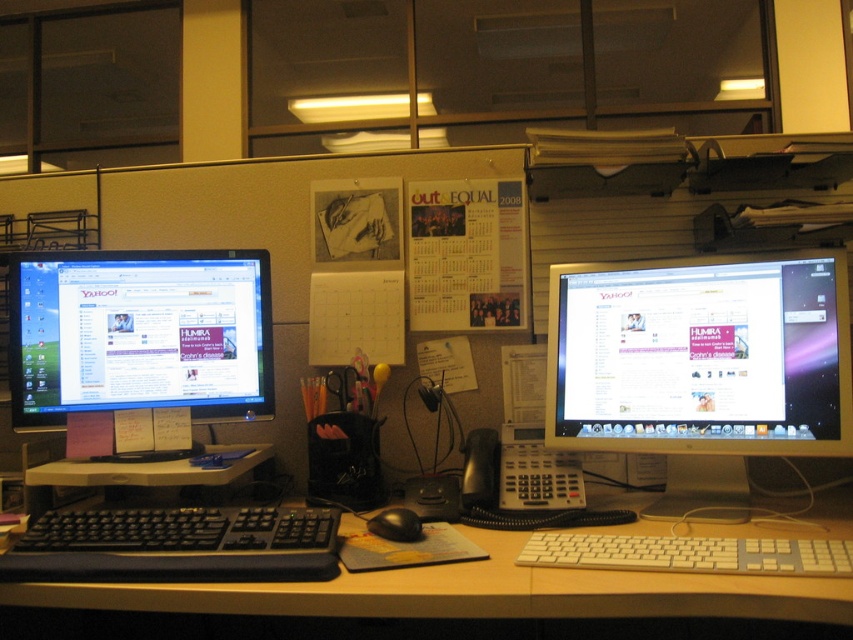
Can you confirm if satin black monitor at center is positioned to the left of matte black monitor at left?

Incorrect, satin black monitor at center is not on the left side of matte black monitor at left.

Measure the distance between satin black monitor at center and matte black monitor at left.

satin black monitor at center and matte black monitor at left are 27.88 inches apart from each other.

Describe the element at coordinates (700, 356) in the screenshot. I see `satin black monitor at center` at that location.

In order to click on satin black monitor at center in this screenshot , I will do `click(700, 356)`.

Can you confirm if satin black monitor at center is positioned to the right of black plastic keyboard at center?

Yes, satin black monitor at center is to the right of black plastic keyboard at center.

Is satin black monitor at center in front of black plastic keyboard at center?

That is False.

Does point (769, 392) come farther from viewer compared to point (67, 529)?

That is True.

You are a GUI agent. You are given a task and a screenshot of the screen. Output one action in this format:
    pyautogui.click(x=<x>, y=<y>)
    Task: Click on the satin black monitor at center
    The image size is (853, 640).
    Given the screenshot: What is the action you would take?
    (x=700, y=356)

Is satin black monitor at center below white plastic keyboard at lower center?

No.

Does satin black monitor at center have a smaller size compared to white plastic keyboard at lower center?

Yes, satin black monitor at center is smaller than white plastic keyboard at lower center.

You are a GUI agent. You are given a task and a screenshot of the screen. Output one action in this format:
    pyautogui.click(x=<x>, y=<y>)
    Task: Click on the satin black monitor at center
    
    Given the screenshot: What is the action you would take?
    pyautogui.click(x=700, y=356)